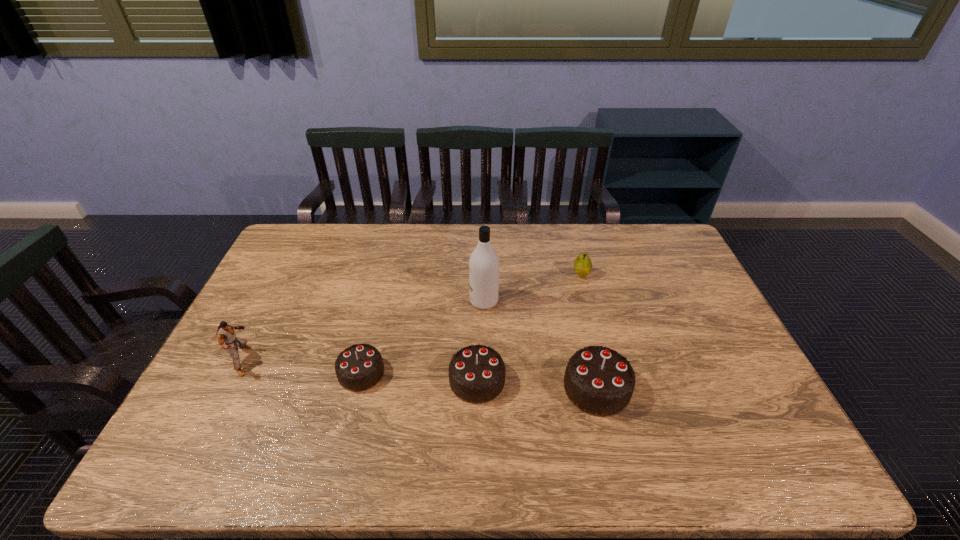
The width and height of the screenshot is (960, 540). Find the location of `the leftmost chocolate cake`. the leftmost chocolate cake is located at coordinates (359, 367).

Where is `the fifth object from right to left`? The height and width of the screenshot is (540, 960). the fifth object from right to left is located at coordinates (359, 367).

Image resolution: width=960 pixels, height=540 pixels. I want to click on the second shortest chocolate cake, so click(476, 374).

You are a GUI agent. You are given a task and a screenshot of the screen. Output one action in this format:
    pyautogui.click(x=<x>, y=<y>)
    Task: Click on the rightmost chocolate cake
    The height and width of the screenshot is (540, 960).
    Given the screenshot: What is the action you would take?
    pyautogui.click(x=598, y=380)

This screenshot has height=540, width=960. I want to click on the leftmost object, so click(225, 333).

Locate an element on the screen. pear is located at coordinates (582, 264).

Where is `the second farthest object`? the second farthest object is located at coordinates (484, 262).

Identify the location of the tallest object. The height and width of the screenshot is (540, 960). (484, 262).

Find the location of `vacant region located 0.330m on the left of the leftmost chocolate cake`. vacant region located 0.330m on the left of the leftmost chocolate cake is located at coordinates [216, 373].

Identify the location of vacant space located on the right of the second shortest chocolate cake. (550, 380).